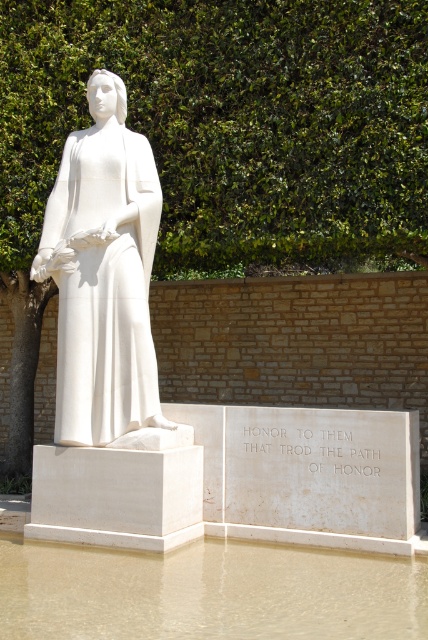
Question: Can you confirm if brown sediment water at lower center is wider than white marble statue at center?

Choices:
 (A) no
 (B) yes

Answer: (B)

Question: Can you confirm if brown sediment water at lower center is positioned above white marble statue at center?

Choices:
 (A) no
 (B) yes

Answer: (A)

Question: Which point is closer to the camera?

Choices:
 (A) (157, 604)
 (B) (77, 284)
 (C) (419, 132)

Answer: (A)

Question: Is brown sediment water at lower center further to the viewer compared to white marble statue at center?

Choices:
 (A) no
 (B) yes

Answer: (A)

Question: Which point is farther to the camera?

Choices:
 (A) (166, 240)
 (B) (142, 198)
 (C) (229, 628)

Answer: (A)

Question: Which point is closer to the camera?

Choices:
 (A) (95, 369)
 (B) (395, 604)

Answer: (B)